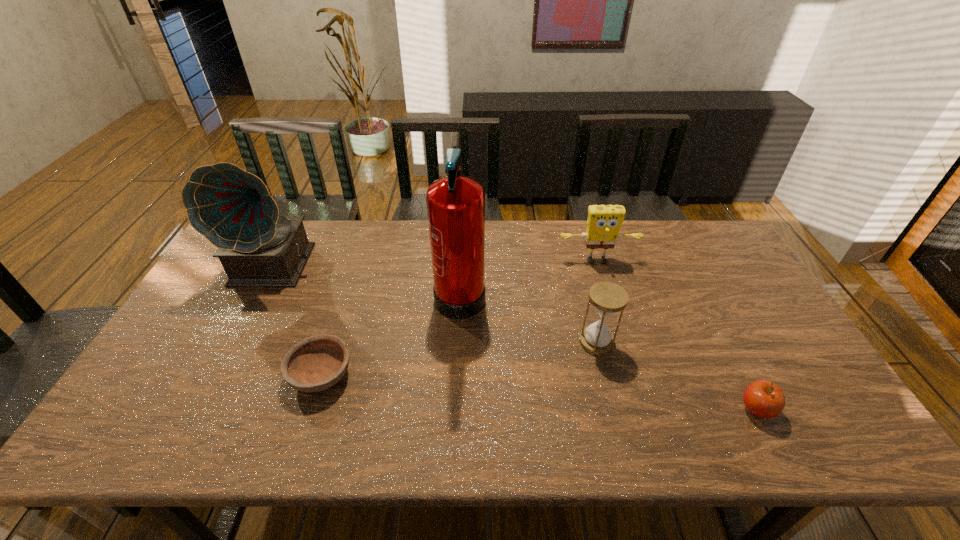
Identify the location of vacant space that is in between the sponge and the apple. [677, 335].

What are the coordinates of `free space between the shortest object and the fire extinguisher` in the screenshot? It's located at (391, 333).

Find the location of `free space between the sponge and the fire extinguisher`. free space between the sponge and the fire extinguisher is located at coordinates (529, 276).

Find the location of a particular element. This screenshot has width=960, height=540. unoccupied area between the second tallest object and the fire extinguisher is located at coordinates (369, 278).

I want to click on empty location between the hourglass and the fire extinguisher, so click(528, 316).

This screenshot has height=540, width=960. Find the location of `vacant region between the hourglass and the bowl`. vacant region between the hourglass and the bowl is located at coordinates (459, 359).

Locate which object is the closest to the second object from left to right. Please provide its 2D coordinates. Your answer should be formatted as a tuple, i.e. [(x, y)], where the tuple contains the x and y coordinates of a point satisfying the conditions above.

[(455, 204)]

Locate which object ranks third in proximity to the leftmost object. Please provide its 2D coordinates. Your answer should be formatted as a tuple, i.e. [(x, y)], where the tuple contains the x and y coordinates of a point satisfying the conditions above.

[(604, 222)]

Where is `vacant space that satisfies the following two spatial constraints: 1. on the face of the fifth tallest object; 2. on the left side of the sponge`? vacant space that satisfies the following two spatial constraints: 1. on the face of the fifth tallest object; 2. on the left side of the sponge is located at coordinates (642, 409).

This screenshot has width=960, height=540. I want to click on blank area in the image that satisfies the following two spatial constraints: 1. on the front side of the hourglass; 2. on the right side of the tallest object, so click(x=458, y=342).